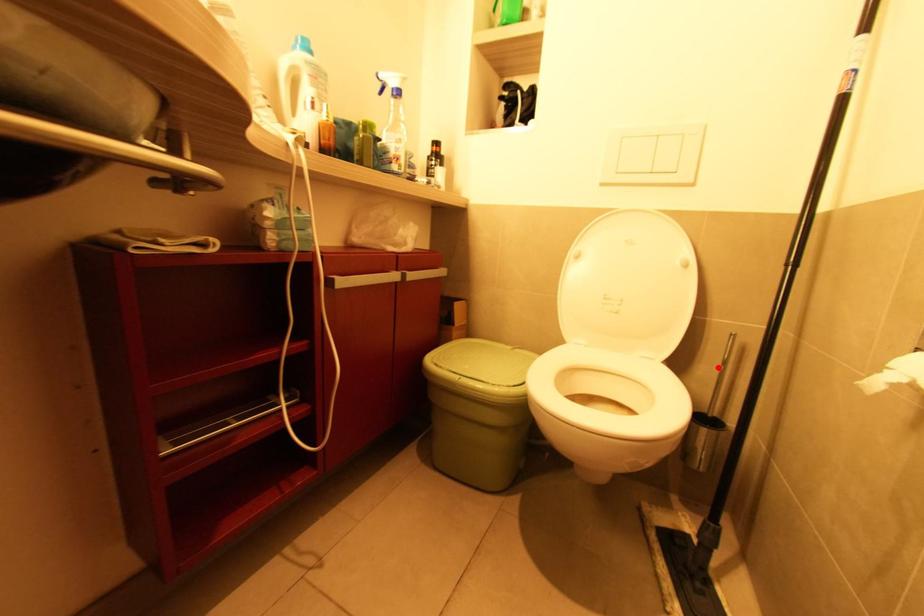
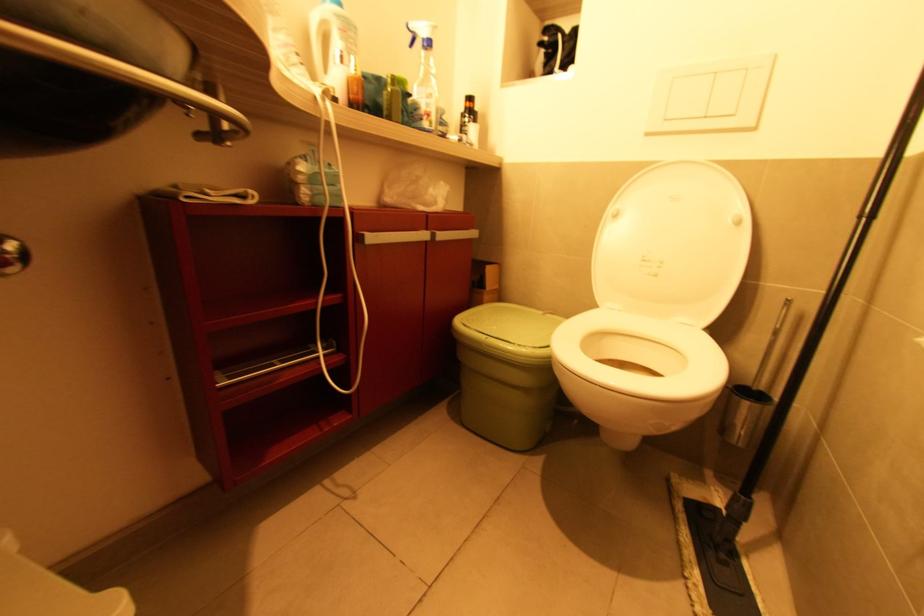
In the second image, find the point that corresponds to the highlighted location in the first image.

(771, 338)